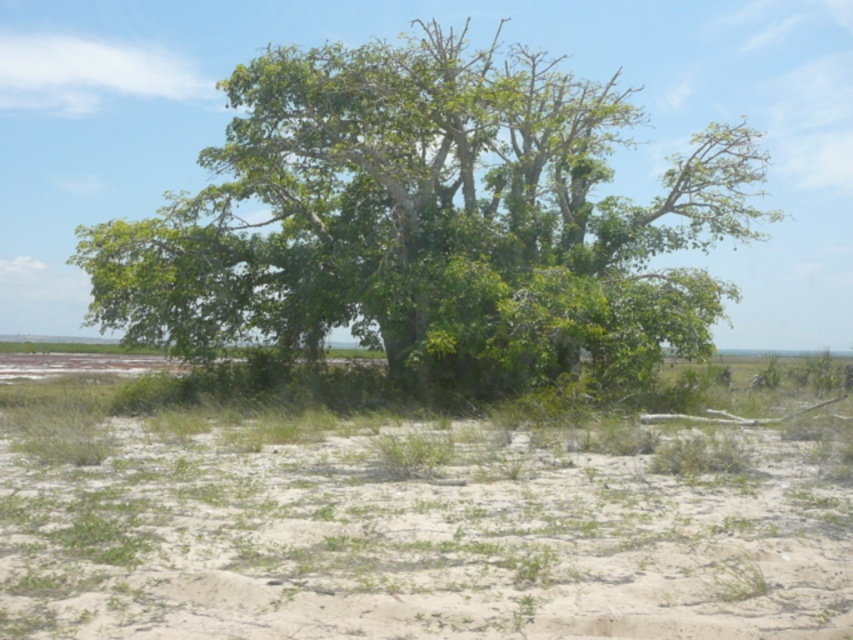
Does green leafy tree at center have a lesser width compared to white sandy soil at lower center?

In fact, green leafy tree at center might be wider than white sandy soil at lower center.

The image size is (853, 640). What do you see at coordinates (431, 224) in the screenshot?
I see `green leafy tree at center` at bounding box center [431, 224].

Is point (605, 348) behind point (448, 602)?

Yes, point (605, 348) is behind point (448, 602).

In order to click on green leafy tree at center in this screenshot , I will do `click(431, 224)`.